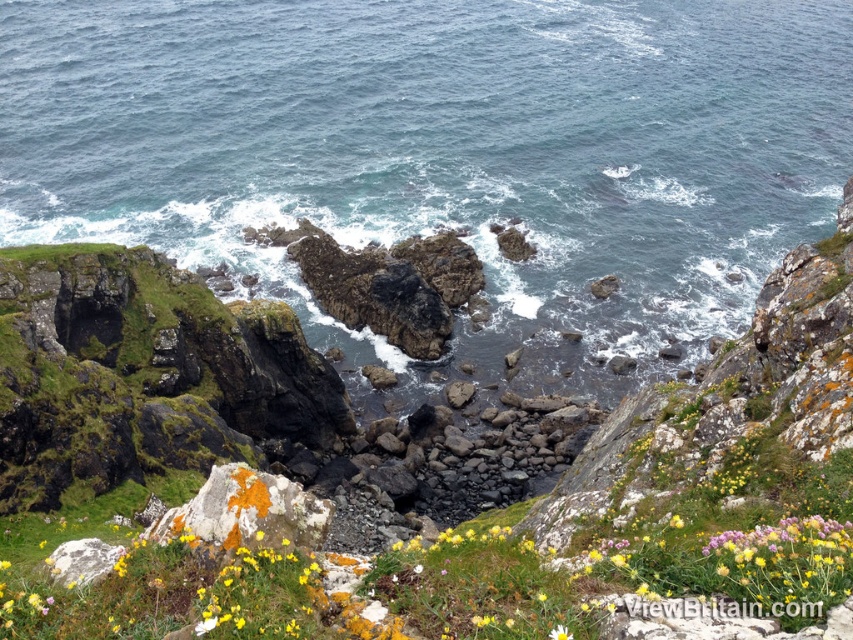
Can you confirm if speckled gray rock at lower left is wider than white matte flower at center?

Result: Correct, the width of speckled gray rock at lower left exceeds that of white matte flower at center.

Between speckled gray rock at lower left and white matte flower at center, which one is positioned higher?

speckled gray rock at lower left is higher up.

Locate an element on the screen. speckled gray rock at lower left is located at coordinates (82, 561).

Can you confirm if blue water at center is taller than white matte flower at center?

Yes.

Who is more distant from viewer, (413, 193) or (561, 627)?

Point (413, 193)

You are a GUI agent. You are given a task and a screenshot of the screen. Output one action in this format:
    pyautogui.click(x=<x>, y=<y>)
    Task: Click on the blue water at center
    The width and height of the screenshot is (853, 640).
    Given the screenshot: What is the action you would take?
    [x=445, y=154]

Does blue water at center have a smaller size compared to speckled gray rock at lower left?

Actually, blue water at center might be larger than speckled gray rock at lower left.

Who is lower down, blue water at center or speckled gray rock at lower left?

speckled gray rock at lower left

The image size is (853, 640). I want to click on blue water at center, so point(445,154).